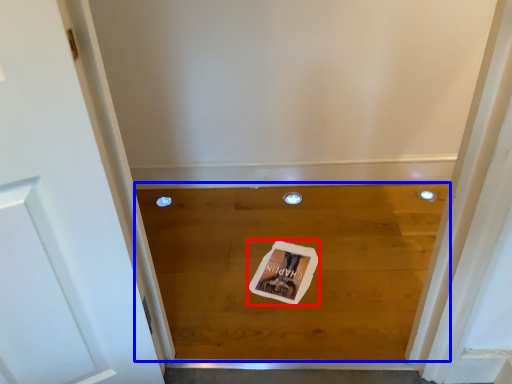
Question: Which point is further to the camera, postcard (highlighted by a red box) or plank (highlighted by a blue box)?

Choices:
 (A) postcard
 (B) plank

Answer: (A)